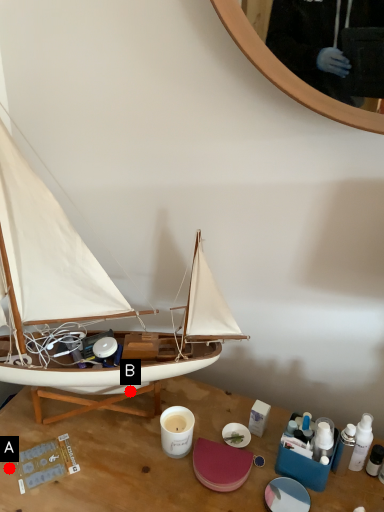
Question: Two points are circled on the image, labeled by A and B beside each circle. Which point is closer to the camera?

Choices:
 (A) A is closer
 (B) B is closer

Answer: (A)